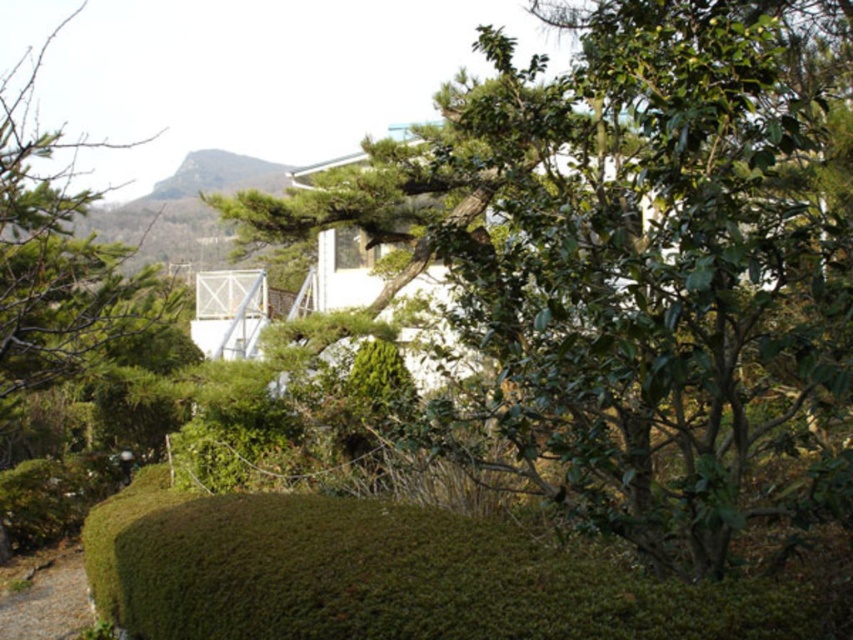
Which is above, green mossy hedge at lower center or green leafy tree at left?

green leafy tree at left is above.

Is point (723, 634) positioned in front of point (97, 252)?

Yes, it is.

You are a GUI agent. You are given a task and a screenshot of the screen. Output one action in this format:
    pyautogui.click(x=<x>, y=<y>)
    Task: Click on the green mossy hedge at lower center
    
    Given the screenshot: What is the action you would take?
    pyautogui.click(x=393, y=577)

Locate an element on the screen. green leafy tree at left is located at coordinates (51, 253).

Is green leafy tree at left taller than brown dirt path at lower left?

Correct, green leafy tree at left is much taller as brown dirt path at lower left.

Image resolution: width=853 pixels, height=640 pixels. Identify the location of green leafy tree at left. (51, 253).

Is green leafy tree at center above brown dirt path at lower left?

Indeed, green leafy tree at center is positioned over brown dirt path at lower left.

Is green leafy tree at center below brown dirt path at lower left?

Incorrect, green leafy tree at center is not positioned below brown dirt path at lower left.

Describe the element at coordinates (630, 266) in the screenshot. This screenshot has height=640, width=853. I see `green leafy tree at center` at that location.

Where is `green leafy tree at center`? green leafy tree at center is located at coordinates (630, 266).